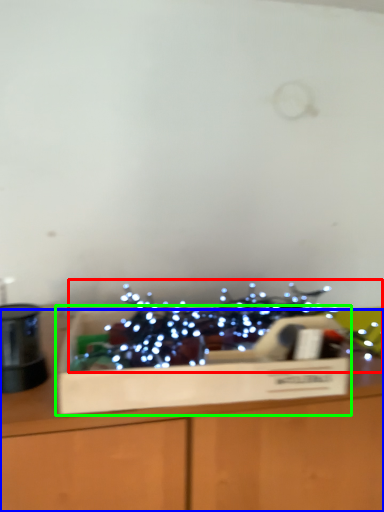
Question: Which object is the closest to the christmas decoration (highlighted by a red box)? Choose among these: table (highlighted by a blue box) or cardboard box (highlighted by a green box).

Choices:
 (A) table
 (B) cardboard box

Answer: (B)